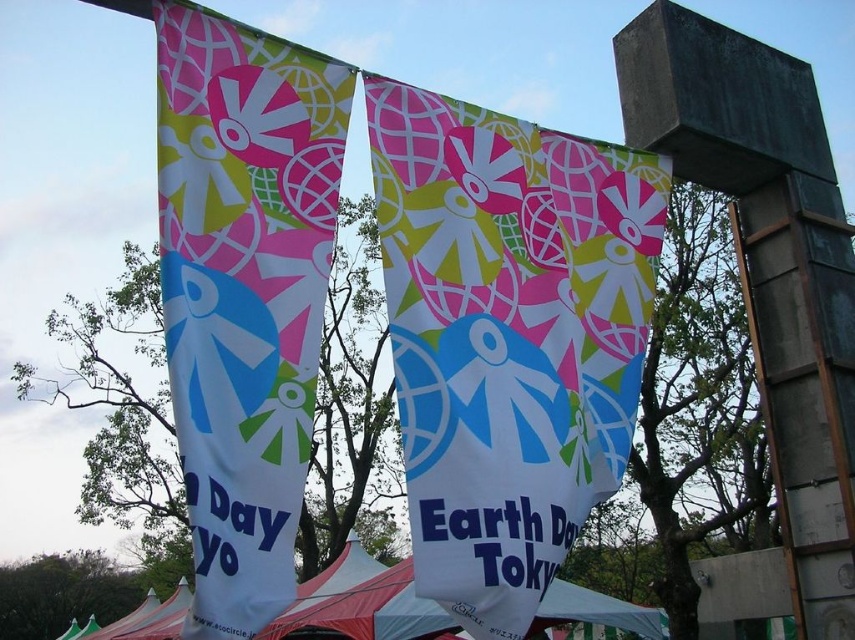
Question: Does matte fabric banner at center have a smaller size compared to white fabric tent at lower center?

Choices:
 (A) no
 (B) yes

Answer: (B)

Question: Is matte fabric banner at center thinner than white fabric tent at lower center?

Choices:
 (A) yes
 (B) no

Answer: (A)

Question: Which of the following is the closest to the observer?

Choices:
 (A) white fabric tent at lower center
 (B) white fabric banner at center

Answer: (B)

Question: Can you confirm if matte fabric banner at center is positioned above white fabric tent at lower center?

Choices:
 (A) yes
 (B) no

Answer: (A)

Question: Based on their relative distances, which object is nearer to the white fabric banner at center?

Choices:
 (A) matte fabric banner at center
 (B) white fabric tent at lower center

Answer: (A)

Question: Which point appears farthest from the camera in this image?

Choices:
 (A) (423, 145)
 (B) (214, 500)
 (C) (396, 595)

Answer: (C)